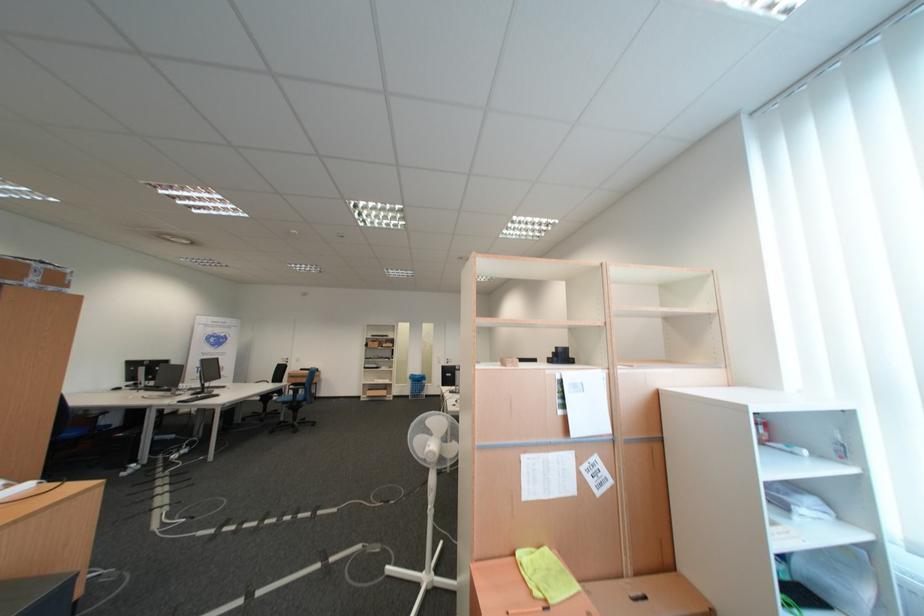
Where is `sanitizer pump`? This screenshot has width=924, height=616. sanitizer pump is located at coordinates (836, 436).